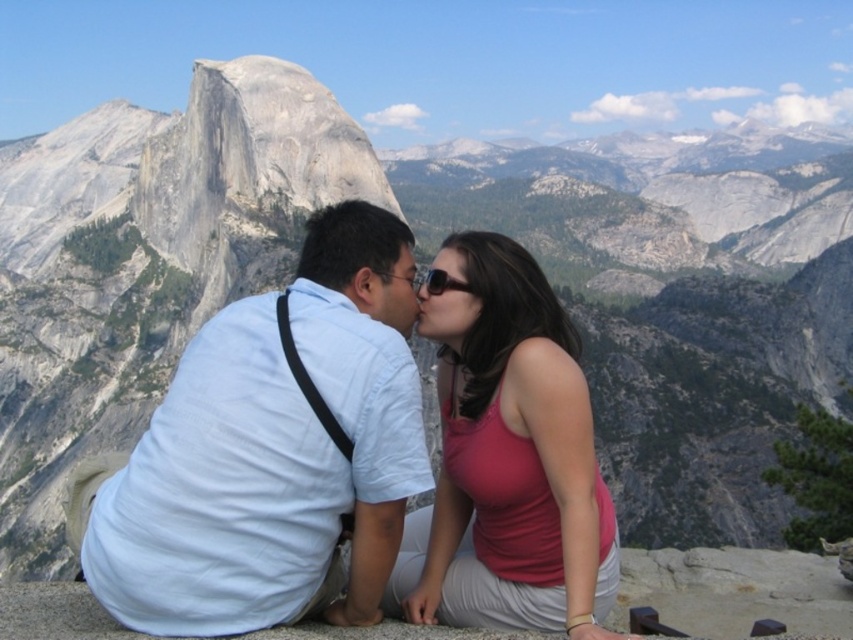
Between point (291, 413) and point (566, 424), which one is positioned behind?

The point (566, 424) is more distant.

Between light blue cotton shirt at center and matte pink tank top at center, which one is positioned higher?

light blue cotton shirt at center

Between point (328, 285) and point (462, 232), which one is positioned in front?

Positioned in front is point (328, 285).

Identify the location of light blue cotton shirt at center. (270, 451).

Does matte pink tank top at center appear over matte black hair at center?

No.

Can you confirm if matte pink tank top at center is bigger than matte black hair at center?

Correct, matte pink tank top at center is larger in size than matte black hair at center.

Identify the location of matte pink tank top at center. The image size is (853, 640). (508, 461).

Does light blue cotton shirt at center have a lesser height compared to matte black hair at center?

No.

Which is in front, point (131, 492) or point (459, 259)?

Point (131, 492) is in front.

You are a GUI agent. You are given a task and a screenshot of the screen. Output one action in this format:
    pyautogui.click(x=<x>, y=<y>)
    Task: Click on the light blue cotton shirt at center
    This screenshot has width=853, height=640.
    Given the screenshot: What is the action you would take?
    pyautogui.click(x=270, y=451)